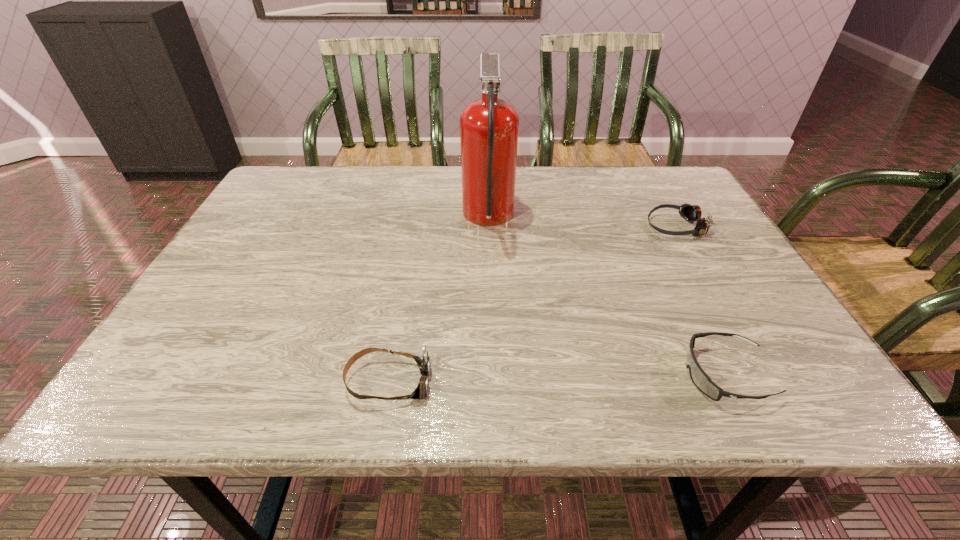
This screenshot has width=960, height=540. What are the coordinates of `free region located on the front-facing side of the leftmost goggles` in the screenshot? It's located at (541, 381).

Where is `object situated at the far edge`? This screenshot has width=960, height=540. object situated at the far edge is located at coordinates (489, 126).

The height and width of the screenshot is (540, 960). I want to click on object located at the near right corner, so click(x=701, y=380).

I want to click on free space at the far edge of the desktop, so click(354, 195).

In the image, there is a desktop. Identify the location of vacant area at the near edge. coord(612,394).

Where is `vacant space at the left edge`? This screenshot has height=540, width=960. vacant space at the left edge is located at coordinates (196, 301).

In order to click on vacant space at the right edge in this screenshot , I will do `click(802, 361)`.

Locate an element on the screen. vacant space at the far left corner of the desktop is located at coordinates (304, 166).

In the image, there is a desktop. Where is `vacant space at the near left corner`? The image size is (960, 540). vacant space at the near left corner is located at coordinates point(192,368).

This screenshot has width=960, height=540. I want to click on free space at the far right corner of the desktop, so click(674, 186).